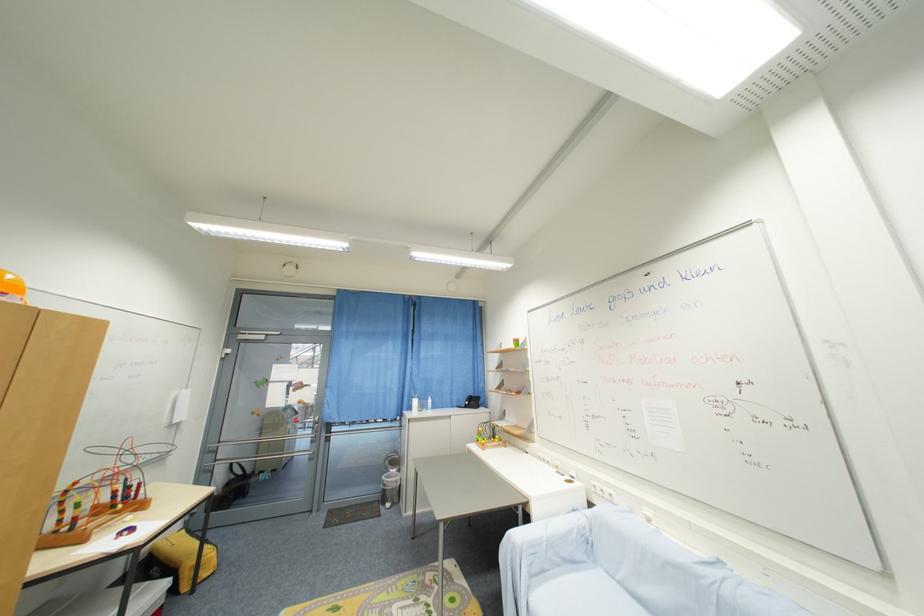
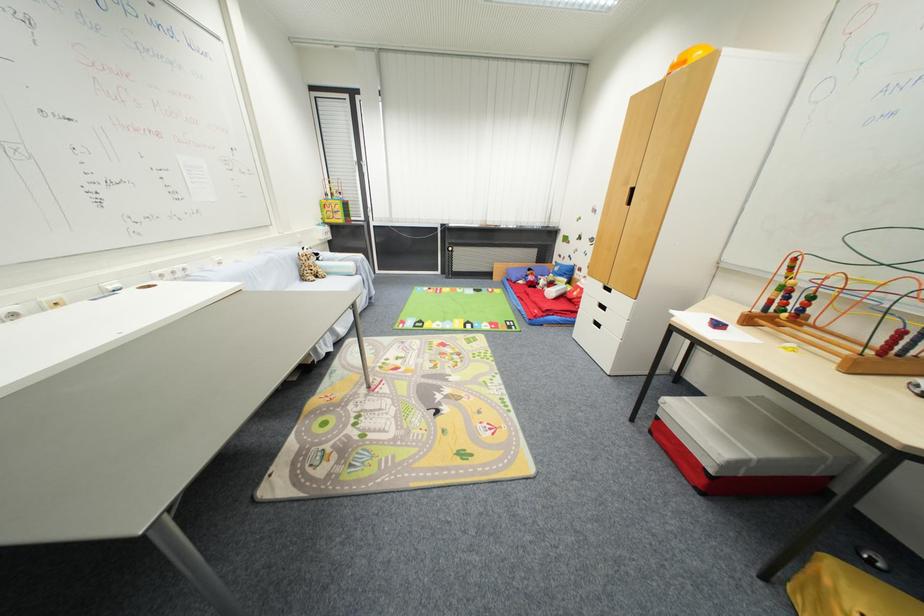
In the second image, find the point that corresponds to point 118,508 in the first image.

(789, 313)